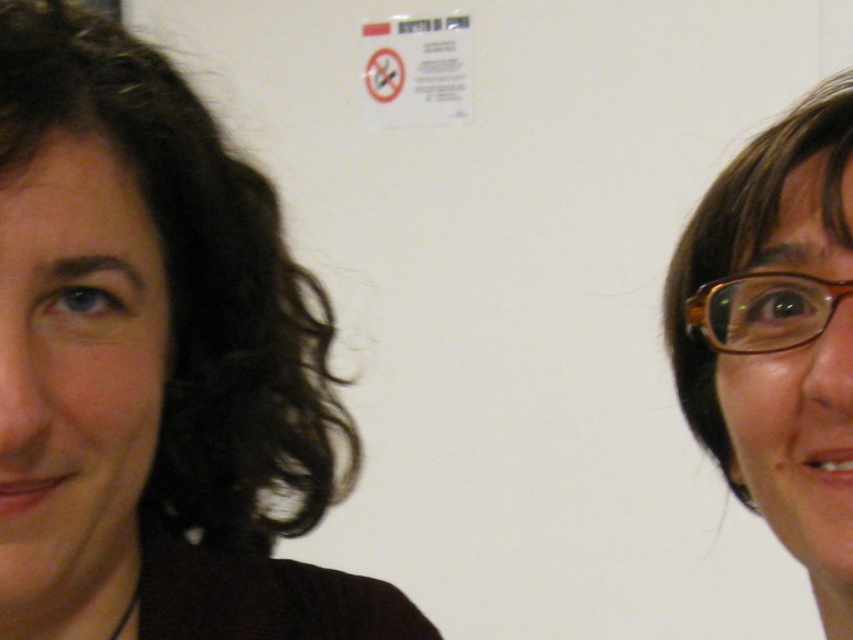
Question: Is dark brown hair at left closer to the viewer compared to brown plastic glasses at right?

Choices:
 (A) yes
 (B) no

Answer: (A)

Question: In this image, where is dark brown hair at left located relative to brown matte glasses at right?

Choices:
 (A) above
 (B) below

Answer: (B)

Question: Considering the real-world distances, which object is closest to the dark brown hair at left?

Choices:
 (A) brown matte glasses at right
 (B) brown plastic glasses at right

Answer: (A)

Question: Among these objects, which one is farthest from the camera?

Choices:
 (A) brown matte glasses at right
 (B) dark brown hair at left
 (C) brown plastic glasses at right

Answer: (C)

Question: Estimate the real-world distances between objects in this image. Which object is farther from the dark brown hair at left?

Choices:
 (A) brown matte glasses at right
 (B) brown plastic glasses at right

Answer: (B)

Question: Is dark brown hair at left further to camera compared to brown plastic glasses at right?

Choices:
 (A) yes
 (B) no

Answer: (B)